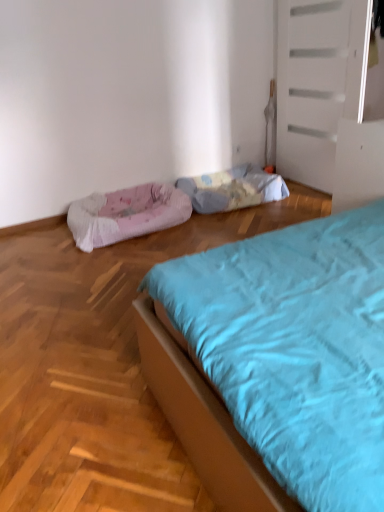
Question: Can you confirm if pink textured dog bed at left is shorter than fluffy blue blanket at center?

Choices:
 (A) no
 (B) yes

Answer: (B)

Question: Is pink textured dog bed at left aimed at fluffy blue blanket at center?

Choices:
 (A) yes
 (B) no

Answer: (B)

Question: Does pink textured dog bed at left have a greater width compared to fluffy blue blanket at center?

Choices:
 (A) yes
 (B) no

Answer: (A)

Question: Is fluffy blue blanket at center located within pink textured dog bed at left?

Choices:
 (A) no
 (B) yes

Answer: (A)

Question: Does pink textured dog bed at left have a greater height compared to fluffy blue blanket at center?

Choices:
 (A) no
 (B) yes

Answer: (A)

Question: From a real-world perspective, is pink textured dog bed at left located beneath fluffy blue blanket at center?

Choices:
 (A) no
 (B) yes

Answer: (A)

Question: Can you confirm if fluffy blue blanket at center is bigger than pink textured dog bed at left?

Choices:
 (A) yes
 (B) no

Answer: (B)

Question: From the image's perspective, is fluffy blue blanket at center under pink textured dog bed at left?

Choices:
 (A) no
 (B) yes

Answer: (A)

Question: From a real-world perspective, is fluffy blue blanket at center located higher than pink textured dog bed at left?

Choices:
 (A) no
 (B) yes

Answer: (A)

Question: Considering the relative sizes of fluffy blue blanket at center and pink textured dog bed at left in the image provided, is fluffy blue blanket at center shorter than pink textured dog bed at left?

Choices:
 (A) yes
 (B) no

Answer: (B)

Question: Does fluffy blue blanket at center have a greater height compared to pink textured dog bed at left?

Choices:
 (A) no
 (B) yes

Answer: (B)

Question: Is fluffy blue blanket at center oriented towards pink textured dog bed at left?

Choices:
 (A) no
 (B) yes

Answer: (A)

Question: From a real-world perspective, is fluffy blue blanket at center physically located above or below pink textured dog bed at left?

Choices:
 (A) below
 (B) above

Answer: (A)